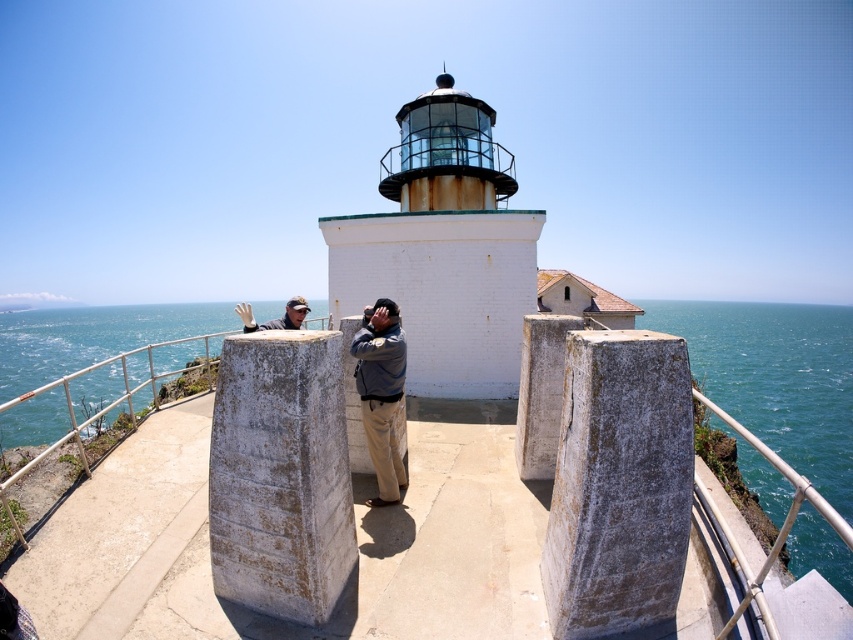
You are a photographer trying to capture the lighthouse and its surroundings. You notice the blue water at center and the denim jacket at center in your viewfinder. Based on their positions, which object should appear closer to you in the photo?

The blue water at center appears closer to you in the photo because it is positioned in front of the denim jacket at center.

You are a photographer trying to capture a wide shot of the white brick lighthouse at center and the denim jacket at center. Based on their relative sizes in the image, which object would appear larger in your photo?

The white brick lighthouse at center would appear larger in the photo because it is wider than the denim jacket at center.

You are standing on the cliff near the ocean and want to take a photo of the white brick lighthouse at center. Where should you position yourself to capture it in the frame?

The white brick lighthouse at center is located at point coordinates (444,248), so you should position yourself at that coordinate to capture it in the frame.